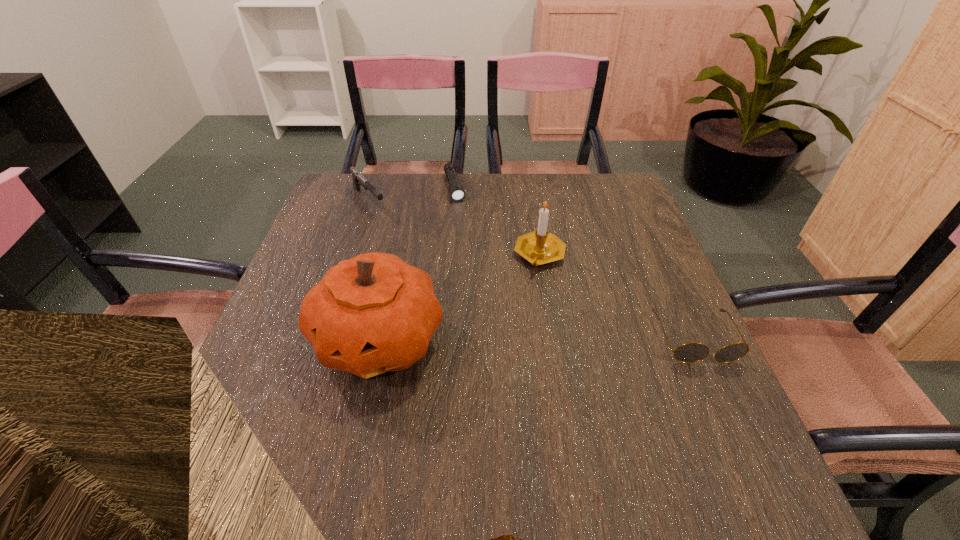
This screenshot has width=960, height=540. Identify the location of pumpkin. (374, 313).

The width and height of the screenshot is (960, 540). I want to click on sunglasses, so click(x=692, y=352).

In order to click on the rightmost object in this screenshot , I will do `click(692, 352)`.

Where is `the third tallest object`? The image size is (960, 540). the third tallest object is located at coordinates (358, 180).

The image size is (960, 540). I want to click on the shortest object, so click(x=457, y=193).

Locate an element on the screen. candle holder is located at coordinates (539, 247).

Find the location of a particular element. The width and height of the screenshot is (960, 540). the fourth shortest object is located at coordinates (539, 247).

The width and height of the screenshot is (960, 540). What are the coordinates of `vacant region located 0.080m on the front-facing side of the pumpkin` in the screenshot? It's located at pyautogui.click(x=358, y=437).

You are a GUI agent. You are given a task and a screenshot of the screen. Output one action in this format:
    pyautogui.click(x=<x>, y=<y>)
    Task: Click on the vacant region located on the lenses of the sunglasses
    The width and height of the screenshot is (960, 540).
    Given the screenshot: What is the action you would take?
    pyautogui.click(x=734, y=426)

The image size is (960, 540). Find the location of `free space located 0.300m at the muzzle end of the third shortest object`. free space located 0.300m at the muzzle end of the third shortest object is located at coordinates (432, 272).